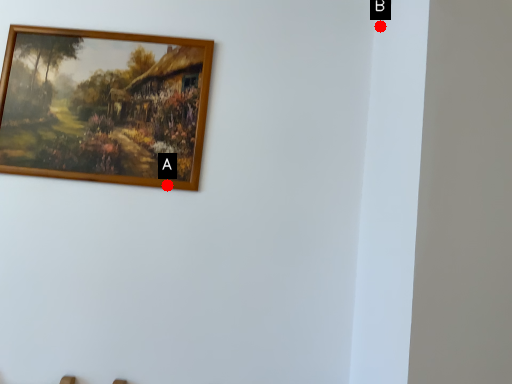
Question: Two points are circled on the image, labeled by A and B beside each circle. Which point is closer to the camera?

Choices:
 (A) A is closer
 (B) B is closer

Answer: (B)